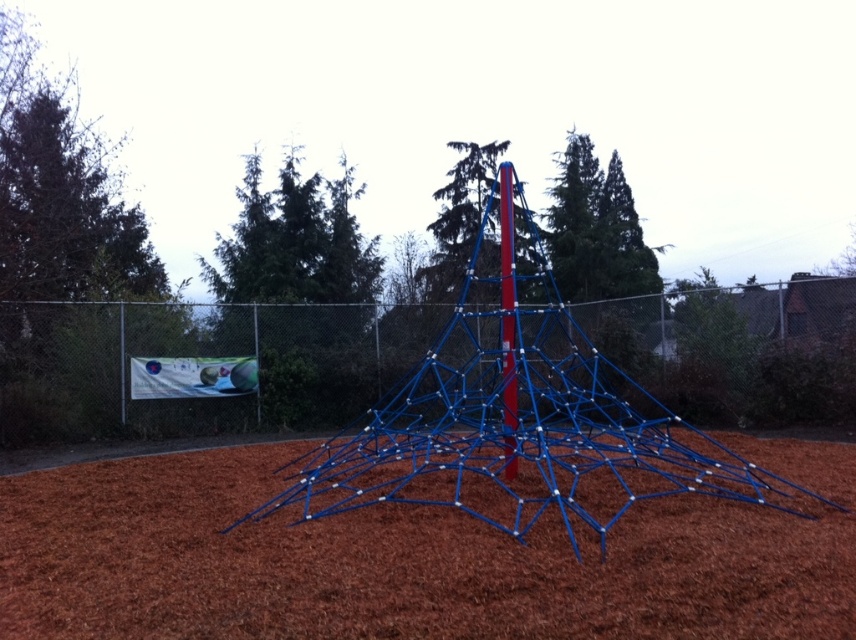
You are a parent supervising children at the playground. You need to ensure there is enough space around the blue metallic climbing frame at center for safety. Based on the scene, does the brown mulch at center provide sufficient coverage around the frame?

The brown mulch at center is smaller than the blue metallic climbing frame at center, meaning the mulch does not fully cover the area around the frame. Therefore, the coverage may not be sufficient for safety requirements.

In the scene shown: You are standing at the playground and want to place a small flag at point A and point B. If point A is point [199,568] and point B is point [508,291], which point is closer to you when you are facing the climbing structure?

Point A, which is point [199,568], is closer to you because it is in front of point B, point [508,291], when facing the climbing structure.